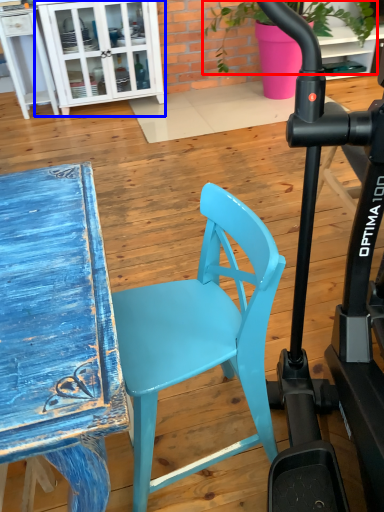
Question: Among these objects, which one is nearest to the camera, plant (highlighted by a red box) or cabinetry (highlighted by a blue box)?

Choices:
 (A) plant
 (B) cabinetry

Answer: (A)